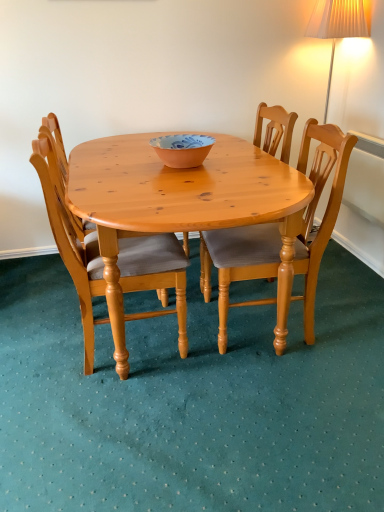
You are a GUI agent. You are given a task and a screenshot of the screen. Output one action in this format:
    pyautogui.click(x=<x>, y=<y>)
    Task: Click on the vacant region below light brown wooden chair at center, arranged as the 1th chair when viewed from the right (from a real-world perspective)
    This screenshot has height=512, width=384.
    Given the screenshot: What is the action you would take?
    pyautogui.click(x=264, y=328)